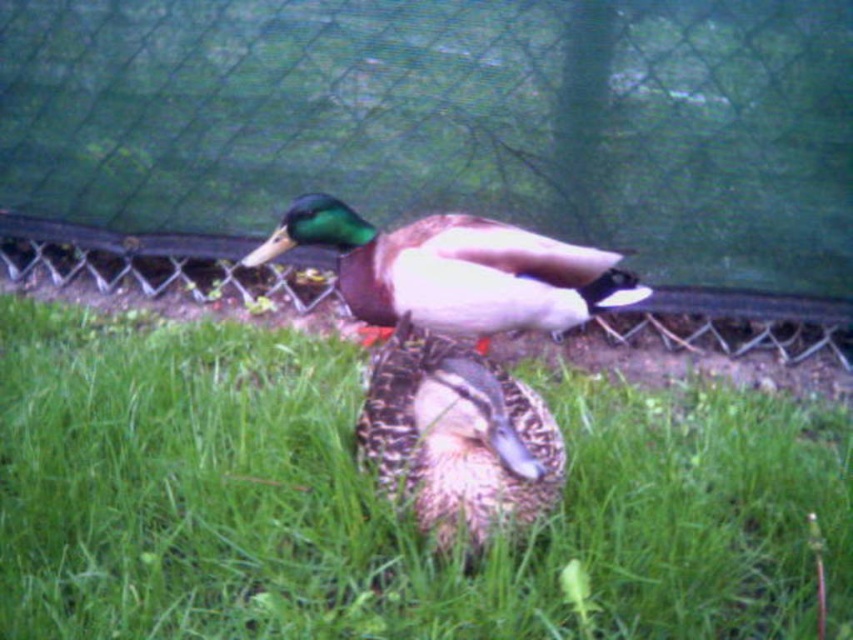
Question: Among these objects, which one is nearest to the camera?

Choices:
 (A) green glossy duck at center
 (B) green mesh fence at center
 (C) green grass at center

Answer: (C)

Question: Can you confirm if green glossy duck at center is positioned to the left of speckled feather duck at center?

Choices:
 (A) no
 (B) yes

Answer: (B)

Question: Among these points, which one is farthest from the camera?

Choices:
 (A) (570, 3)
 (B) (70, 616)
 (C) (444, 388)

Answer: (A)

Question: Which point is closer to the camera?

Choices:
 (A) (50, 204)
 (B) (494, 330)
 (C) (245, 518)

Answer: (C)

Question: Is green mesh fence at center to the right of green grass at center from the viewer's perspective?

Choices:
 (A) no
 (B) yes

Answer: (B)

Question: Is green mesh fence at center smaller than green glossy duck at center?

Choices:
 (A) yes
 (B) no

Answer: (B)